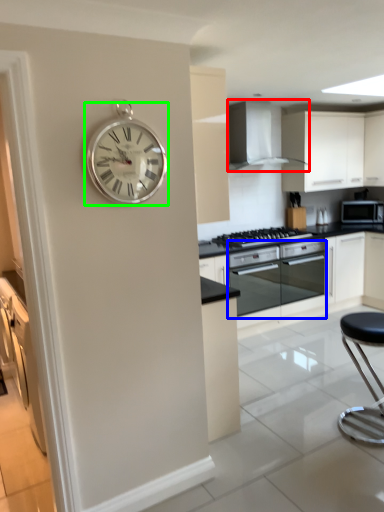
Question: Which object is positioned farthest from home appliance (highlighted by a red box)? Select from oven (highlighted by a blue box) and wall clock (highlighted by a green box).

Choices:
 (A) oven
 (B) wall clock

Answer: (B)